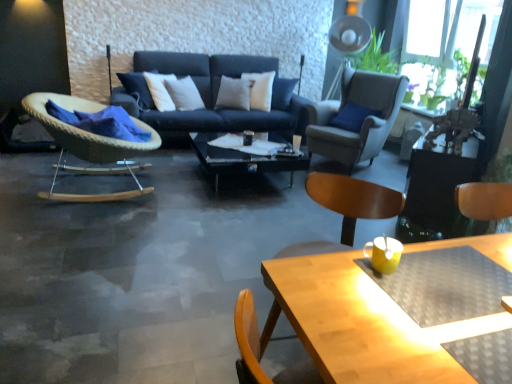
Question: Is wooden beach chair at lower right bigger than transparent glass coffee table at center?

Choices:
 (A) no
 (B) yes

Answer: (A)

Question: Is transparent glass coffee table at center a part of wooden beach chair at lower right?

Choices:
 (A) no
 (B) yes

Answer: (A)

Question: Is wooden beach chair at lower right looking in the opposite direction of transparent glass coffee table at center?

Choices:
 (A) yes
 (B) no

Answer: (B)

Question: Considering the relative sizes of wooden beach chair at lower right and transparent glass coffee table at center in the image provided, is wooden beach chair at lower right thinner than transparent glass coffee table at center?

Choices:
 (A) no
 (B) yes

Answer: (B)

Question: Is wooden beach chair at lower right shorter than transparent glass coffee table at center?

Choices:
 (A) yes
 (B) no

Answer: (B)

Question: Based on their sizes in the image, would you say woven wood rocking chair at left, arranged as the first chair when viewed from the left, is bigger or smaller than black glossy side table at right?

Choices:
 (A) small
 (B) big

Answer: (B)

Question: Is point (141, 124) positioned closer to the camera than point (428, 216)?

Choices:
 (A) closer
 (B) farther

Answer: (B)

Question: In terms of height, does woven wood rocking chair at left, arranged as the first chair when viewed from the left, look taller or shorter compared to black glossy side table at right?

Choices:
 (A) tall
 (B) short

Answer: (A)

Question: Considering their positions, is woven wood rocking chair at left, acting as the 2th chair starting from the right, located in front of or behind black glossy side table at right?

Choices:
 (A) front
 (B) behind

Answer: (A)

Question: Is point (340, 246) closer or farther from the camera than point (372, 82)?

Choices:
 (A) closer
 (B) farther

Answer: (A)

Question: In terms of width, does wooden beach chair at lower right look wider or thinner when compared to suede-like beige armchair at upper right, arranged as the 1th chair when viewed from the right?

Choices:
 (A) thin
 (B) wide

Answer: (A)

Question: Is wooden beach chair at lower right inside the boundaries of suede-like beige armchair at upper right, arranged as the 1th chair when viewed from the right, or outside?

Choices:
 (A) outside
 (B) inside

Answer: (A)

Question: From their relative heights in the image, would you say wooden beach chair at lower right is taller or shorter than suede-like beige armchair at upper right, arranged as the 1th chair when viewed from the right?

Choices:
 (A) tall
 (B) short

Answer: (B)

Question: Is wooden beach chair at lower right bigger or smaller than green leafy plant at upper right?

Choices:
 (A) big
 (B) small

Answer: (A)

Question: Which is correct: wooden beach chair at lower right is inside green leafy plant at upper right, or outside of it?

Choices:
 (A) inside
 (B) outside

Answer: (B)